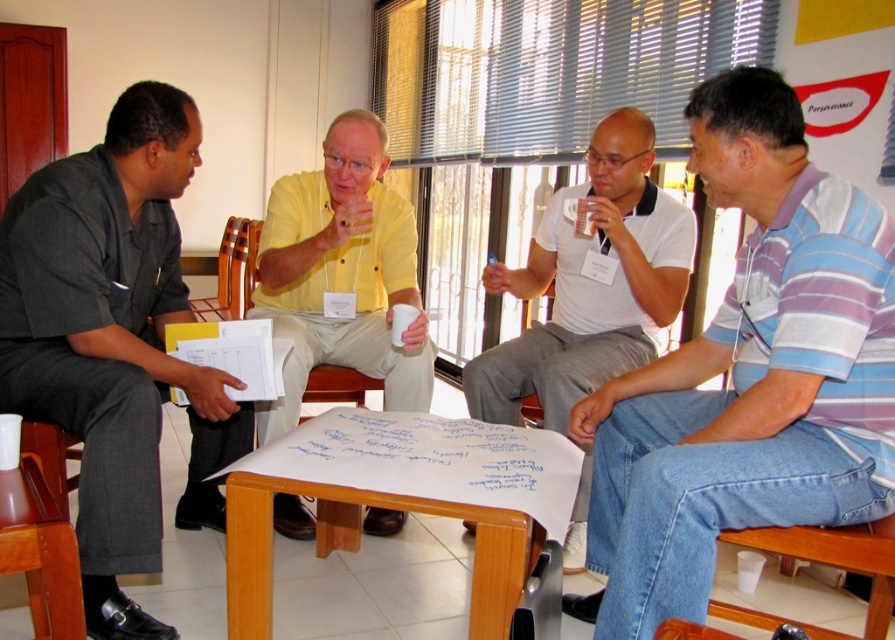
Question: Is blue striped polo shirt at right wider than yellow matte shirt at center?

Choices:
 (A) no
 (B) yes

Answer: (A)

Question: Does blue striped polo shirt at right have a larger size compared to white plastic chair at lower right?

Choices:
 (A) yes
 (B) no

Answer: (A)

Question: Does wooden table at center appear on the right side of yellow matte shirt at center?

Choices:
 (A) yes
 (B) no

Answer: (A)

Question: Which point is farther to the camera?

Choices:
 (A) (267, 420)
 (B) (433, 419)
 (C) (190, 428)
 (D) (626, 576)

Answer: (C)

Question: Based on their relative distances, which object is nearer to the blue striped polo shirt at right?

Choices:
 (A) white matte shirt at center
 (B) yellow matte shirt at center
 (C) dark gray shirt at left

Answer: (A)

Question: Which of these objects is positioned closest to the brown wood chair at lower left?

Choices:
 (A) dark gray shirt at left
 (B) white matte shirt at center
 (C) blue striped polo shirt at right

Answer: (A)